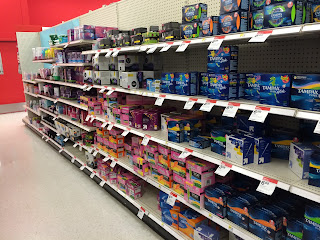
Locate an element on the screen. white and beige shelves is located at coordinates (172, 96), (175, 146), (164, 189), (154, 220), (163, 43).